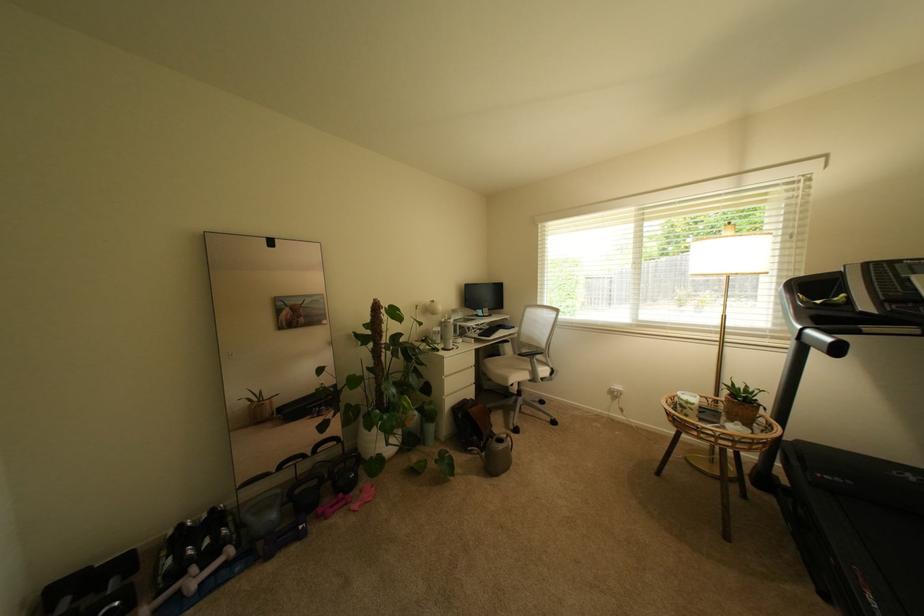
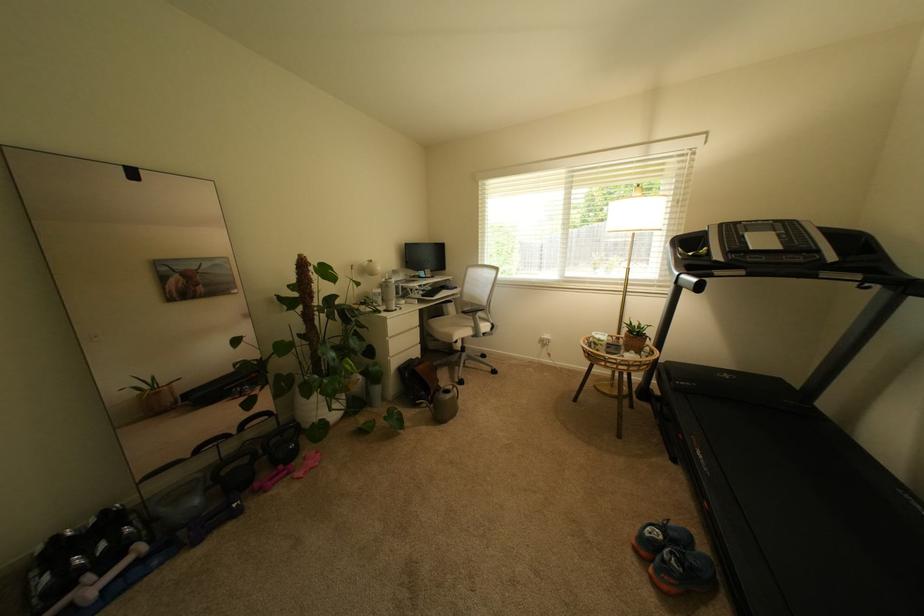
In the second image, find the point that corresponds to the point at 211,569 in the first image.

(111, 573)